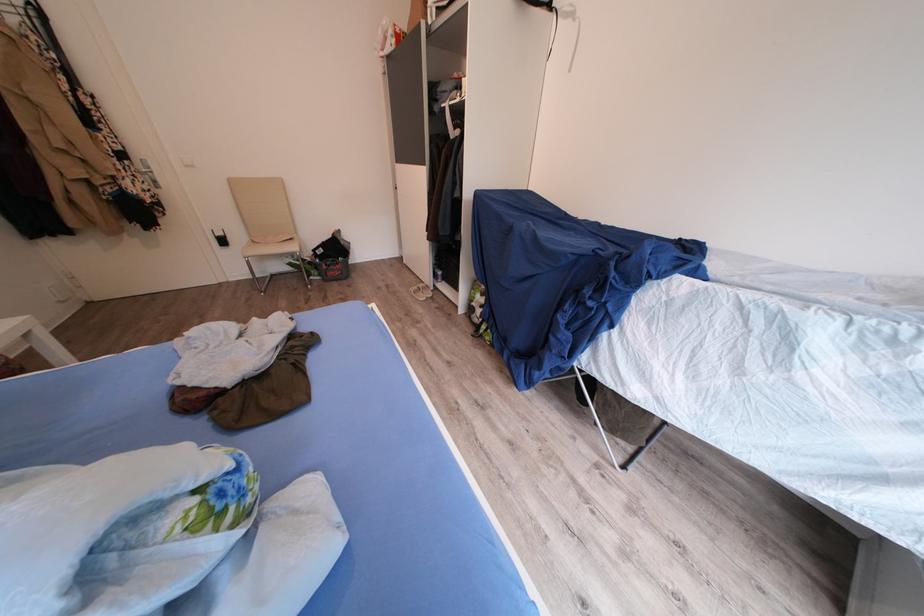
Which object does [419,291] point to?

It refers to a white flip-flop.